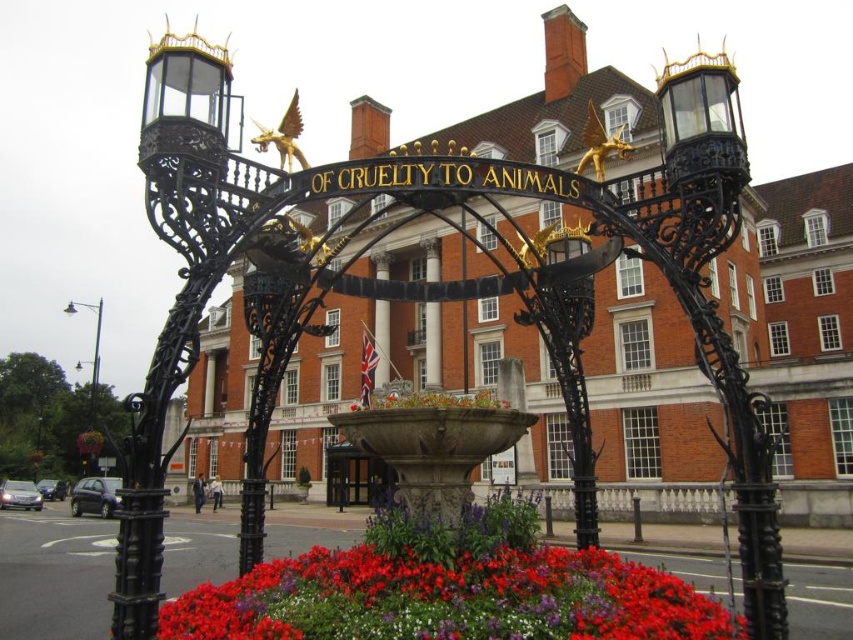
You are standing in front of the archway and want to place a floral bouquet at center. Considering the distance from where you are standing, will the bouquet be visible to someone standing 100 feet away on the street?

The floral bouquet at center is 100.92 feet from the viewer, so someone standing 100 feet away on the street would be slightly closer and might still see it, but the exact visibility depends on factors like line of sight and obstacles not mentioned in the scene description.